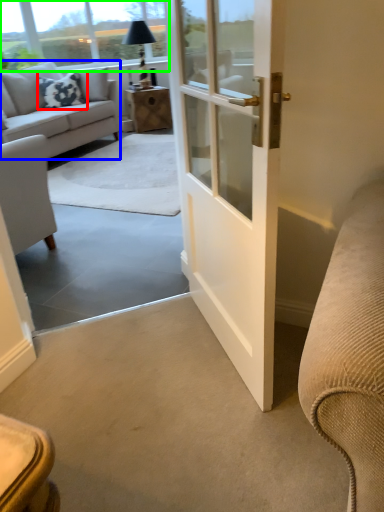
Question: Which is farther away from pillow (highlighted by a red box)? studio couch (highlighted by a blue box) or window screen (highlighted by a green box)?

Choices:
 (A) studio couch
 (B) window screen

Answer: (B)